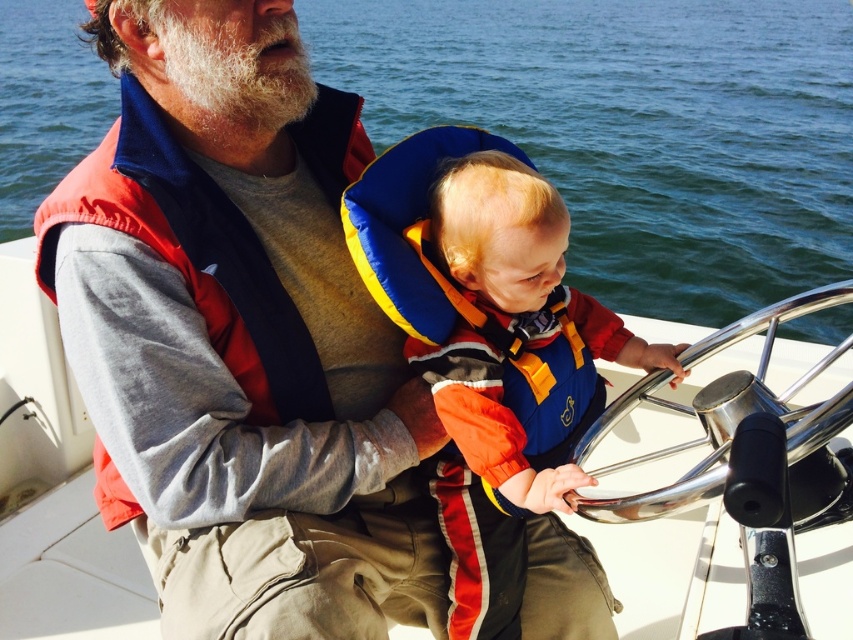
Question: Does blue water at center have a greater width compared to metallic silver boat at center?

Choices:
 (A) no
 (B) yes

Answer: (B)

Question: Which object is the closest to the blue/yellow life vest at center?

Choices:
 (A) metallic silver boat at center
 (B) blue water at center

Answer: (A)

Question: Which point is farther from the camera taking this photo?

Choices:
 (A) coord(59,508)
 (B) coord(628,29)
 (C) coord(474,298)

Answer: (B)

Question: Does blue water at center have a lesser width compared to blue/yellow life vest at center?

Choices:
 (A) yes
 (B) no

Answer: (B)

Question: Does blue water at center appear on the left side of metallic silver boat at center?

Choices:
 (A) yes
 (B) no

Answer: (A)

Question: Which point is farther to the camera?

Choices:
 (A) (76, 88)
 (B) (843, 433)

Answer: (A)